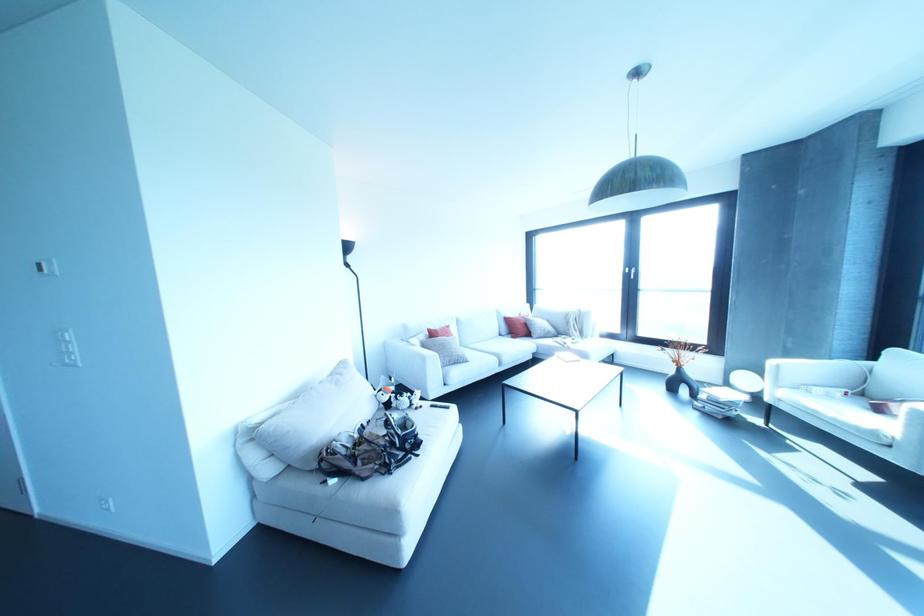
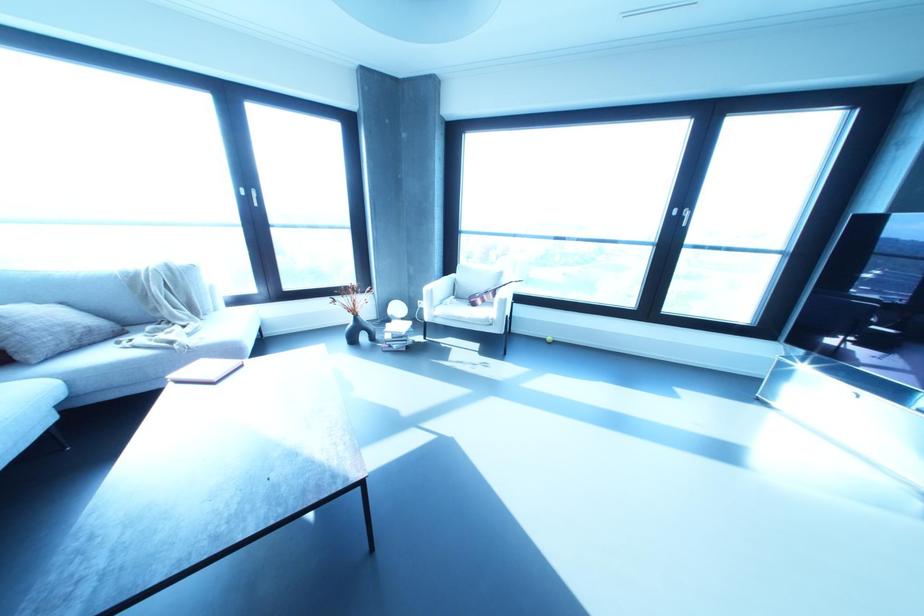
Find the pixel in the second image that matches pixel 772 362 in the first image.

(426, 288)